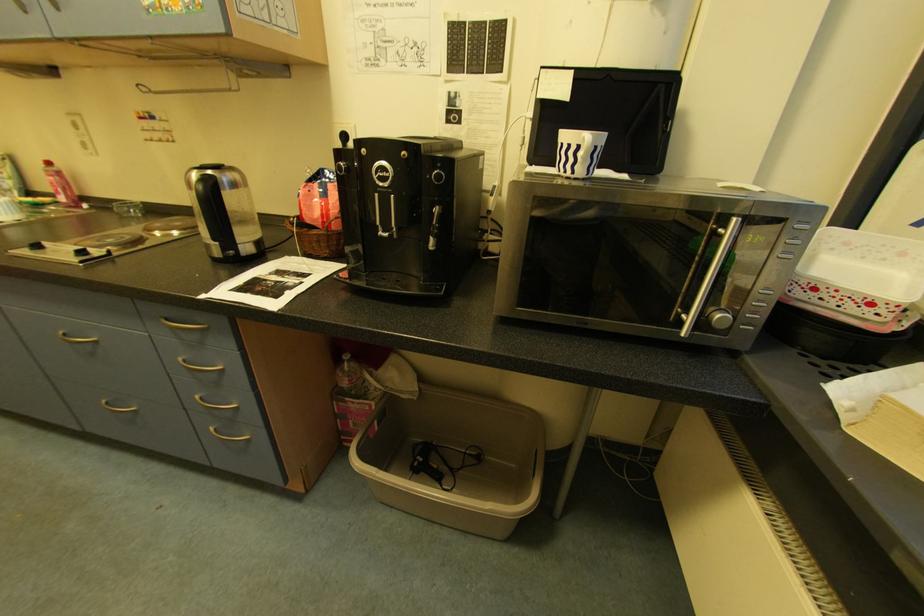
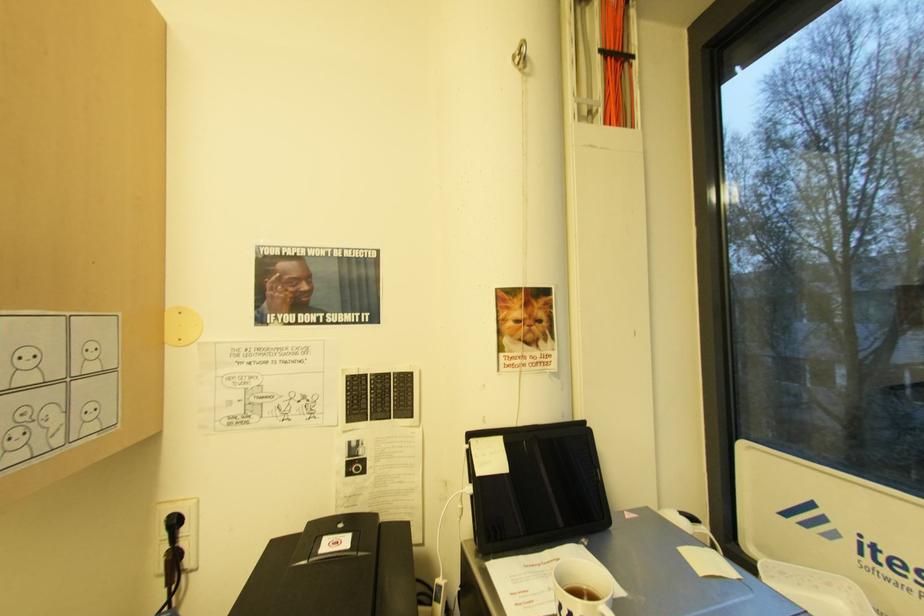
The first image is from the beginning of the video and the second image is from the end. How did the camera likely rotate when shooting the video?

The rotation direction of the camera is right-up.